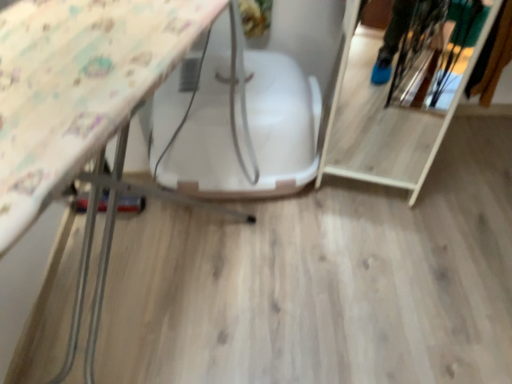
Question: Which is correct: wooden shelf at right is inside white plastic swivel chair at center, or outside of it?

Choices:
 (A) inside
 (B) outside

Answer: (B)

Question: In the image, is wooden shelf at right positioned in front of or behind white plastic swivel chair at center?

Choices:
 (A) front
 (B) behind

Answer: (A)

Question: From a real-world perspective, is wooden shelf at right physically located above or below white plastic swivel chair at center?

Choices:
 (A) above
 (B) below

Answer: (A)

Question: In the image, is white plastic swivel chair at center on the left side or the right side of wooden shelf at right?

Choices:
 (A) right
 (B) left

Answer: (B)

Question: From a real-world perspective, is white plastic swivel chair at center positioned above or below wooden shelf at right?

Choices:
 (A) above
 (B) below

Answer: (B)

Question: In terms of size, does white plastic swivel chair at center appear bigger or smaller than wooden shelf at right?

Choices:
 (A) big
 (B) small

Answer: (A)

Question: From the image's perspective, relative to wooden shelf at right, is white plastic swivel chair at center above or below?

Choices:
 (A) above
 (B) below

Answer: (B)